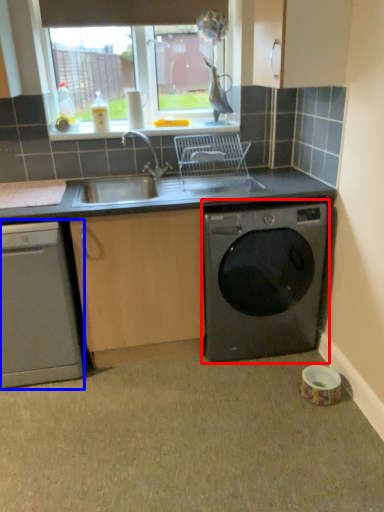
Question: Which point is closer to the camera, washing machine (highlighted by a red box) or dishwasher (highlighted by a blue box)?

Choices:
 (A) washing machine
 (B) dishwasher

Answer: (B)